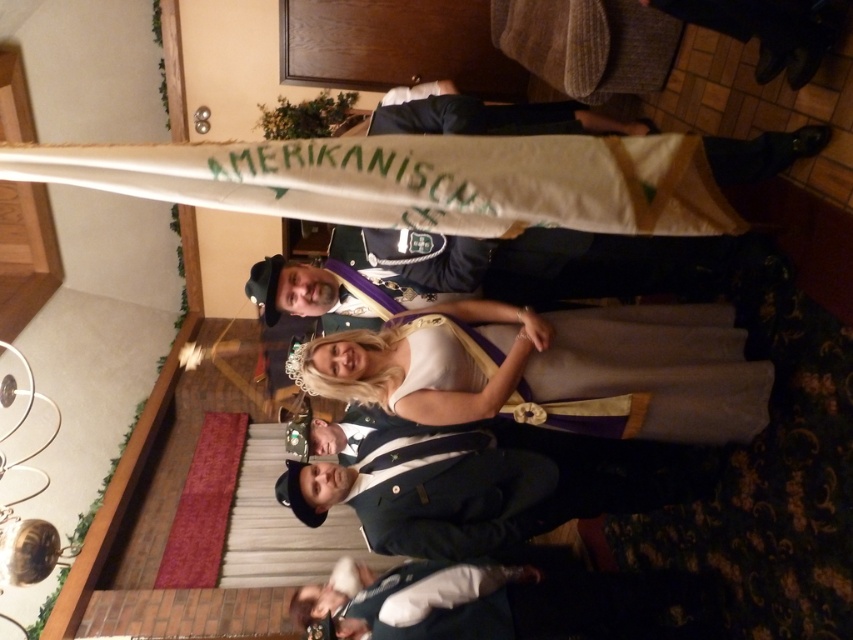
You are a photographer at the event and need to ensure both the white satin dress at center and the dark blue suit at center are fully visible in the photo. Which one should you focus on first to avoid cropping the top of the image?

The white satin dress at center is taller than the dark blue suit at center, so you should focus on capturing the white satin dress at center first to ensure its full height is visible in the photo.

You are an event planner arranging a photo shoot at the venue. You need to position a camera at the center of the room. Where should you place the camera to capture the white satin dress at center in the best possible position?

The white satin dress at center is located at point (554, 371), so placing the camera at the center of the room would best capture it by aligning the camera to face that coordinate.

You are standing in the banquet hall and want to move from the point at coordinates point [669,330] to the point at coordinates point [442,440]. Which direction should you move to reach your destination?

Since point [669,330] is behind point [442,440], you should move forward to reach point [442,440] from point [669,330].